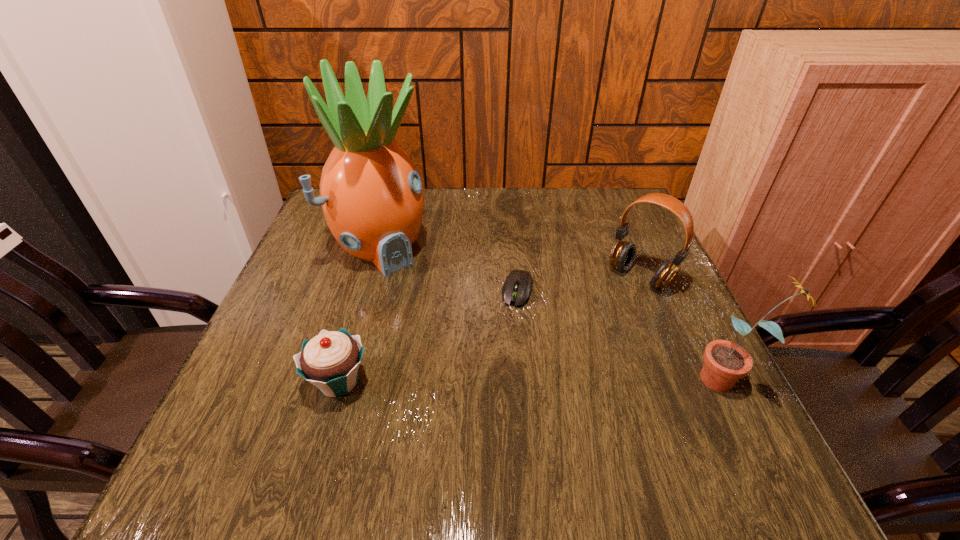
This screenshot has height=540, width=960. Find the location of `free region at the near edge of the desktop`. free region at the near edge of the desktop is located at coordinates (399, 404).

This screenshot has height=540, width=960. In order to click on vacant space at the left edge of the desktop in this screenshot , I will do pos(288,285).

At what (x,y) coordinates should I click in order to perform the action: click on free point at the right edge. Please return your answer as a coordinate pair (x, y). The height and width of the screenshot is (540, 960). Looking at the image, I should click on (668, 322).

At what (x,y) coordinates should I click in order to perform the action: click on blank space at the far right corner of the desktop. Please return your answer as a coordinate pair (x, y). Looking at the image, I should click on (645, 231).

This screenshot has height=540, width=960. In order to click on free space between the sunflower and the second shortest object in this screenshot , I will do `click(534, 380)`.

In order to click on free point between the computer mouse and the cupcake in this screenshot , I will do `click(428, 336)`.

Identify the location of vacant space that's between the cupcake and the third object from right to left. The image size is (960, 540). click(x=428, y=336).

This screenshot has height=540, width=960. I want to click on empty space that is in between the third shortest object and the cupcake, so click(490, 329).

The height and width of the screenshot is (540, 960). Find the location of `free space between the sunflower and the cupcake`. free space between the sunflower and the cupcake is located at coordinates 534,380.

At what (x,y) coordinates should I click in order to perform the action: click on vacant point located between the fourth tallest object and the shortest object. Please return your answer as a coordinate pair (x, y). Looking at the image, I should click on (428, 336).